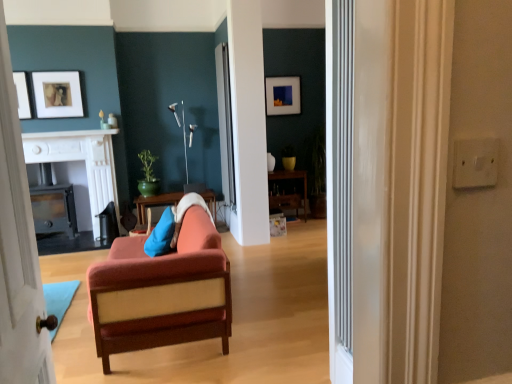
Question: From their relative heights in the image, would you say matte black picture frame at upper center, positioned as the 1th picture frame in right-to-left order, is taller or shorter than white glossy fireplace at upper center?

Choices:
 (A) short
 (B) tall

Answer: (B)

Question: Is point (281, 81) positioned closer to the camera than point (70, 134)?

Choices:
 (A) closer
 (B) farther

Answer: (B)

Question: Which is nearer to the white glossy fireplace at upper center?

Choices:
 (A) matte white picture frame at upper left, marked as the 2th picture frame in a right-to-left arrangement
 (B) clear glass door at center
 (C) matte white picture frame at upper left, which appears as the 3th picture frame when viewed from the back
 (D) white painted wood door at left
 (E) metallic silver lamp at upper center

Answer: (A)

Question: Based on their relative distances, which object is farther from the white glossy fireplace at left?

Choices:
 (A) matte white picture frame at upper left, the second picture frame from the back
 (B) blue fabric pillow at center
 (C) clear glass door at center
 (D) matte white picture frame at upper left, positioned as the 1th picture frame in front-to-back order
 (E) metallic silver lamp at upper center

Answer: (B)